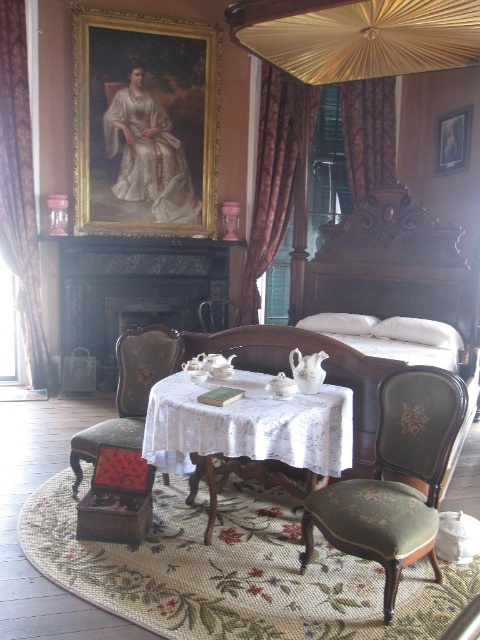
You are standing in the vintage bedroom and want to open the curtains to let more light in. Which curtain, the silky brown curtain at left or the velvet burgundy curtain at upper right, is positioned higher up?

The velvet burgundy curtain at upper right is positioned higher up than the silky brown curtain at left.

In the scene shown: You are arranging flowers in this bedroom and need to choose between placing a large bouquet under the silky brown curtain at left or the velvet burgundy curtain at upper right. Which curtain has enough space to accommodate the bouquet?

The silky brown curtain at left is bigger than the velvet burgundy curtain at upper right, so it has enough space to accommodate the bouquet.